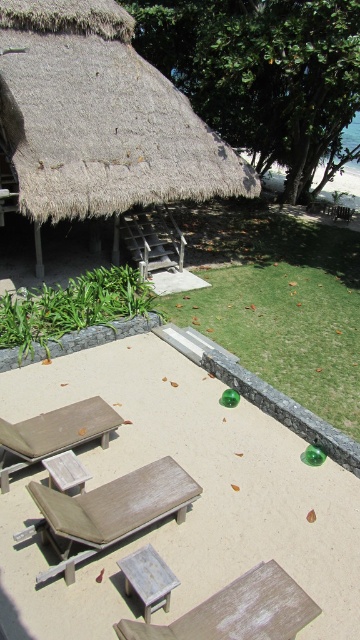
Is brown wood sand at center smaller than wooden lounge chair at center?

Incorrect, brown wood sand at center is not smaller in size than wooden lounge chair at center.

Is point (299, 436) closer to viewer compared to point (113, 504)?

No, it is not.

Locate an element on the screen. Image resolution: width=360 pixels, height=640 pixels. brown wood sand at center is located at coordinates (194, 502).

Is point (39, 432) positioned before point (132, 557)?

No.

Who is more distant from viewer, (x=1, y=422) or (x=128, y=560)?

Point (x=1, y=422)

Is point (88, 422) farther from camera compared to point (132, 576)?

Yes.

Find the location of a particular element. matte brown lounge chair at center is located at coordinates (55, 433).

How much distance is there between brown wood sand at center and white painted wood picnic table at center?

A distance of 3.62 feet exists between brown wood sand at center and white painted wood picnic table at center.

Does brown wood sand at center have a smaller size compared to white painted wood picnic table at center?

No, brown wood sand at center is not smaller than white painted wood picnic table at center.

Is point (78, 595) less distant than point (162, 605)?

That is False.

You are a GUI agent. You are given a task and a screenshot of the screen. Output one action in this format:
    pyautogui.click(x=<x>, y=<y>)
    Task: Click on the brown wood sand at center
    
    Given the screenshot: What is the action you would take?
    pyautogui.click(x=194, y=502)